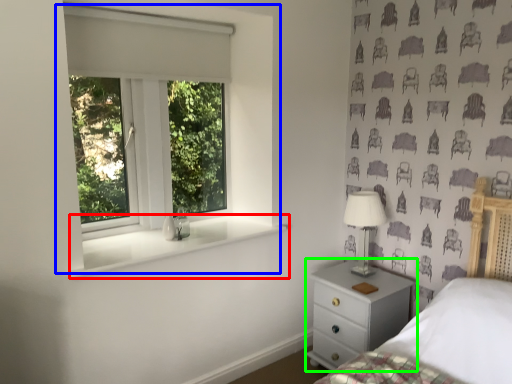
Question: Considering the real-world distances, which object is farthest from window sill (highlighted by a red box)? window (highlighted by a blue box) or chest of drawers (highlighted by a green box)?

Choices:
 (A) window
 (B) chest of drawers

Answer: (B)